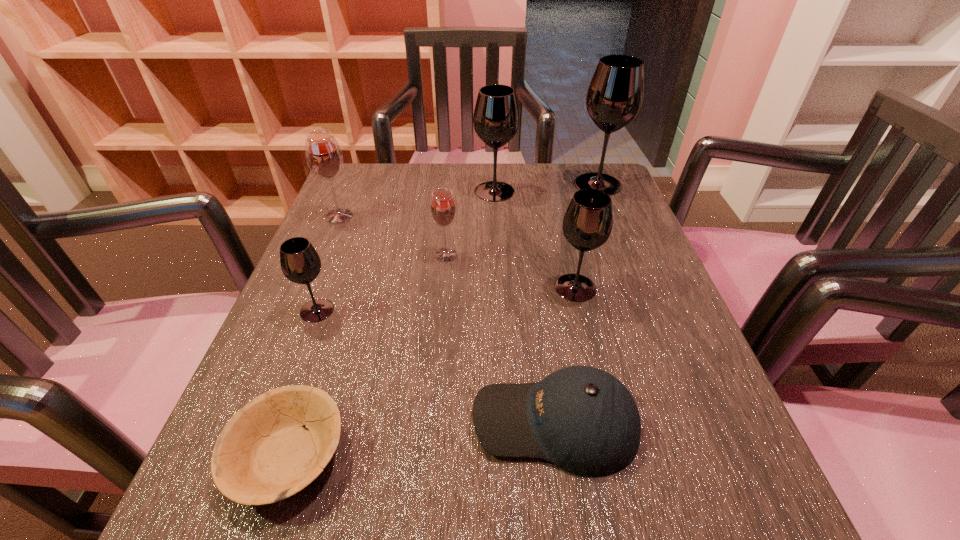
In the image, there is a desktop. Find the location of `vacant region at the far edge`. vacant region at the far edge is located at coordinates (399, 204).

In the image, there is a desktop. Where is `blank space at the near edge`? blank space at the near edge is located at coordinates click(402, 494).

In the image, there is a desktop. Where is `free space at the left edge`? This screenshot has height=540, width=960. free space at the left edge is located at coordinates (346, 341).

You are a GUI agent. You are given a task and a screenshot of the screen. Output one action in this format:
    pyautogui.click(x=<x>, y=<y>)
    Task: Click on the vacant space at the right edge
    
    Given the screenshot: What is the action you would take?
    pyautogui.click(x=635, y=276)

Find the location of a particular element. Image resolution: width=960 pixels, height=540 pixels. free region at the far left corner of the desktop is located at coordinates (394, 164).

Locate an element on the screen. The image size is (960, 540). vacant space in between the third gray wineglass from left to right and the second gray wineglass from left to right is located at coordinates (535, 239).

Where is `vacant space that is in between the shortest object and the left red wineglass`? Image resolution: width=960 pixels, height=540 pixels. vacant space that is in between the shortest object and the left red wineglass is located at coordinates (314, 336).

What are the coordinates of `vacant area that lies between the second tallest object and the bowl` in the screenshot? It's located at (392, 323).

The width and height of the screenshot is (960, 540). Find the location of `unoccupied area between the smallest gray wineglass and the seventh tallest object`. unoccupied area between the smallest gray wineglass and the seventh tallest object is located at coordinates (436, 366).

Where is `unoccupied area between the left red wineglass and the fifth object from right to left`? unoccupied area between the left red wineglass and the fifth object from right to left is located at coordinates (393, 235).